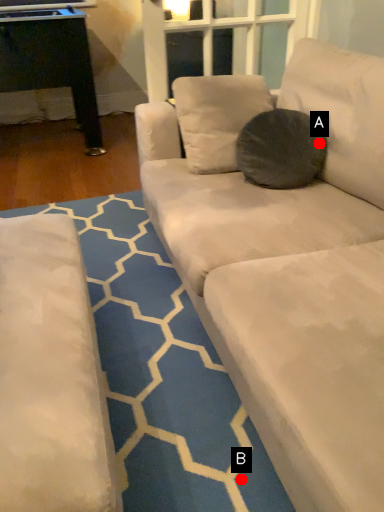
Question: Two points are circled on the image, labeled by A and B beside each circle. Which point is further to the camera?

Choices:
 (A) A is further
 (B) B is further

Answer: (A)